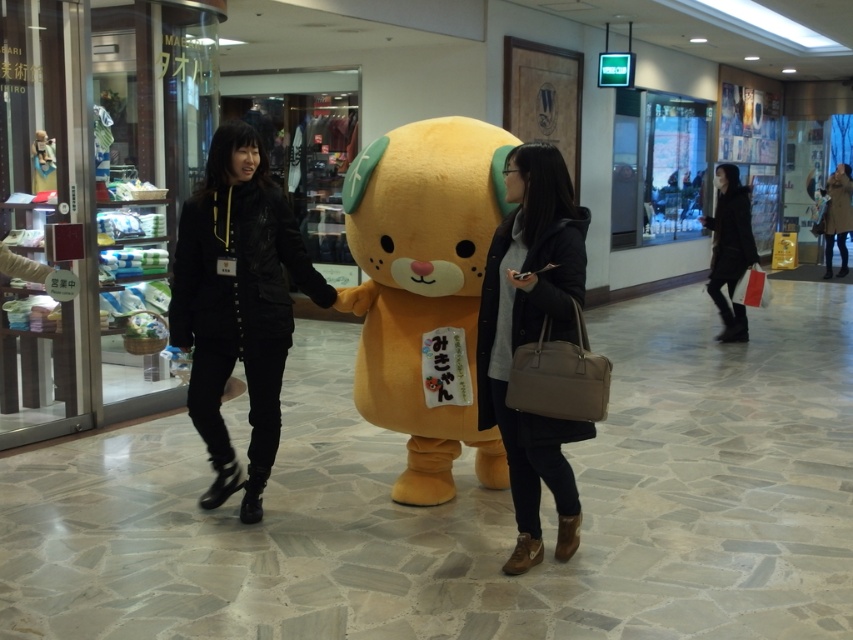
Is soft plush teddy bear at center wider than black leather jacket at center?

Yes, soft plush teddy bear at center is wider than black leather jacket at center.

Does soft plush teddy bear at center have a lesser width compared to black leather jacket at center?

No, soft plush teddy bear at center is not thinner than black leather jacket at center.

Describe the element at coordinates (424, 292) in the screenshot. I see `soft plush teddy bear at center` at that location.

Identify the location of soft plush teddy bear at center. Image resolution: width=853 pixels, height=640 pixels. pyautogui.click(x=424, y=292).

Is matte black coat at center positioned behind black matte coat at right?

No, it is in front of black matte coat at right.

Can you confirm if matte black coat at center is shorter than black matte coat at right?

Correct, matte black coat at center is not as tall as black matte coat at right.

Locate an element on the screen. This screenshot has width=853, height=640. matte black coat at center is located at coordinates (532, 339).

Is black leather jacket at center closer to the viewer compared to matte black coat at center?

No, black leather jacket at center is further to the viewer.

Between point (281, 246) and point (575, 506), which one is positioned behind?

The point (281, 246) is behind.

The image size is (853, 640). Identify the location of black leather jacket at center. (236, 304).